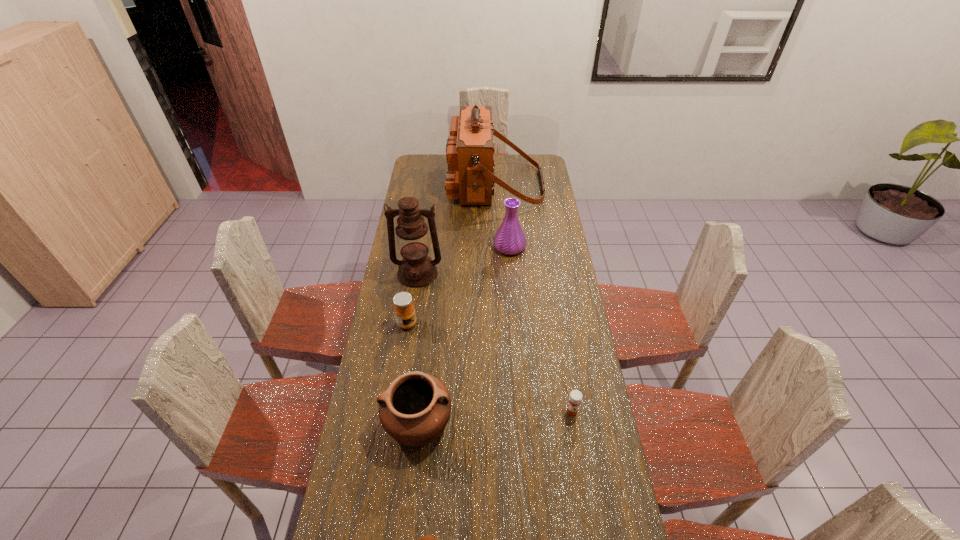
You are a GUI agent. You are given a task and a screenshot of the screen. Output one action in this format:
    pyautogui.click(x=<x>, y=<y>)
    Task: Click on the satchel
    
    Given the screenshot: What is the action you would take?
    pyautogui.click(x=470, y=177)

Find the location of a particular element. The height and width of the screenshot is (540, 960). oil lamp is located at coordinates click(416, 269).

This screenshot has width=960, height=540. I want to click on the fifth shortest object, so click(510, 239).

Where is `the second farthest object`? This screenshot has width=960, height=540. the second farthest object is located at coordinates click(510, 239).

The width and height of the screenshot is (960, 540). What are the coordinates of `the fourth shortest object` in the screenshot? It's located at (414, 409).

What are the coordinates of `the fourth farthest object` in the screenshot? It's located at (404, 310).

The width and height of the screenshot is (960, 540). In order to click on the third shortest object in this screenshot , I will do `click(404, 310)`.

Identify the location of the sixth tallest object. (575, 397).

Where is `blank area located on the face side of the farthest object`? blank area located on the face side of the farthest object is located at coordinates (409, 185).

At what (x,y) coordinates should I click in order to perform the action: click on free space located on the face side of the farthest object. Please return your answer as a coordinate pair (x, y). The height and width of the screenshot is (540, 960). Looking at the image, I should click on (407, 185).